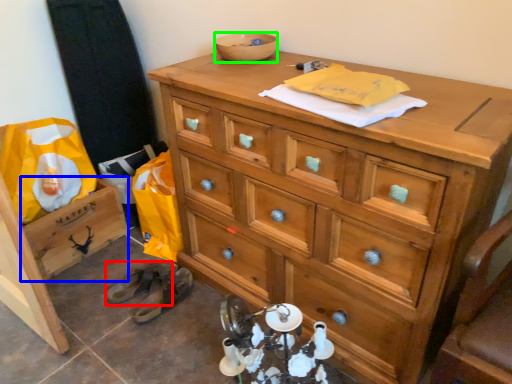
Question: Based on their relative distances, which object is nearer to shoe (highlighted by a red box)? Choose from cabinetry (highlighted by a blue box) and bowl (highlighted by a green box).

Choices:
 (A) cabinetry
 (B) bowl

Answer: (A)